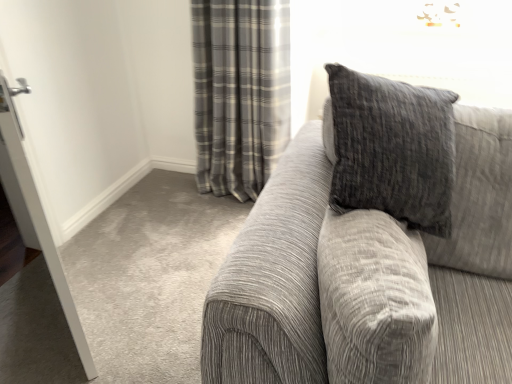
Image resolution: width=512 pixels, height=384 pixels. I want to click on white glossy door at left, so pyautogui.click(x=39, y=214).

This screenshot has width=512, height=384. What do you see at coordinates (240, 92) in the screenshot? I see `gray plaid curtain at upper center` at bounding box center [240, 92].

At what (x,y) coordinates should I click in order to perform the action: click on white glossy door at left. Please return your answer as a coordinate pair (x, y). This screenshot has width=512, height=384. Looking at the image, I should click on (39, 214).

Considering the sizes of objects textured gray couch at right and white glossy door at left in the image provided, who is shorter, textured gray couch at right or white glossy door at left?

Standing shorter between the two is textured gray couch at right.

Measure the distance from textured gray couch at right to white glossy door at left.

textured gray couch at right and white glossy door at left are 33.07 inches apart.

Is textured gray couch at right at the left side of white glossy door at left?

Incorrect, textured gray couch at right is not on the left side of white glossy door at left.

From a real-world perspective, is textured gray couch at right above or below white glossy door at left?

textured gray couch at right is situated lower than white glossy door at left in the real world.

Is white glossy door at left to the left of gray plaid curtain at upper center from the viewer's perspective?

Correct, you'll find white glossy door at left to the left of gray plaid curtain at upper center.

Is white glossy door at left facing towards gray plaid curtain at upper center?

No, white glossy door at left is not facing towards gray plaid curtain at upper center.

Does white glossy door at left have a greater width compared to gray plaid curtain at upper center?

In fact, white glossy door at left might be narrower than gray plaid curtain at upper center.

This screenshot has height=384, width=512. Find the location of `screen door that is in front of the gray plaid curtain at upper center`. screen door that is in front of the gray plaid curtain at upper center is located at coordinates (39, 214).

From a real-world perspective, who is located lower, gray plaid curtain at upper center or textured gray couch at right?

In real-world perspective, textured gray couch at right is lower.

Choose the correct answer: Is gray plaid curtain at upper center inside textured gray couch at right or outside it?

gray plaid curtain at upper center is outside textured gray couch at right.

How many degrees apart are the facing directions of gray plaid curtain at upper center and textured gray couch at right?

There is a 4.1-degree angle between the facing directions of gray plaid curtain at upper center and textured gray couch at right.

Is gray plaid curtain at upper center touching white glossy door at left?

No, gray plaid curtain at upper center is not touching white glossy door at left.

From a real-world perspective, does gray plaid curtain at upper center sit lower than white glossy door at left?

Yes, from a real-world perspective, gray plaid curtain at upper center is below white glossy door at left.

Looking at this image, is gray plaid curtain at upper center aimed at white glossy door at left?

Yes, gray plaid curtain at upper center is facing white glossy door at left.

Consider the image. Who is taller, textured gray couch at right or gray plaid curtain at upper center?

gray plaid curtain at upper center is taller.

Considering the relative sizes of textured gray couch at right and gray plaid curtain at upper center in the image provided, is textured gray couch at right bigger than gray plaid curtain at upper center?

Yes, textured gray couch at right is bigger than gray plaid curtain at upper center.

What's the angular difference between textured gray couch at right and gray plaid curtain at upper center's facing directions?

The angular difference between textured gray couch at right and gray plaid curtain at upper center is 4.1 degrees.

Which object is wider, textured gray couch at right or gray plaid curtain at upper center?

textured gray couch at right.

From the image's perspective, is white glossy door at left on textured gray couch at right?

Yes, from the image's perspective, white glossy door at left is over textured gray couch at right.

Is white glossy door at left oriented towards textured gray couch at right?

No, white glossy door at left is not facing towards textured gray couch at right.

Between white glossy door at left and textured gray couch at right, which one has larger width?

textured gray couch at right.

Considering the relative positions of white glossy door at left and textured gray couch at right in the image provided, is white glossy door at left behind textured gray couch at right?

Yes, white glossy door at left is further from the viewer.

The height and width of the screenshot is (384, 512). I want to click on studio couch below the white glossy door at left (from a real-world perspective), so click(373, 248).

Where is `curtain above the white glossy door at left (from the image's perspective)`? The width and height of the screenshot is (512, 384). curtain above the white glossy door at left (from the image's perspective) is located at coordinates pos(240,92).

Which object lies nearer to the anchor point textured gray couch at right, white glossy door at left or gray plaid curtain at upper center?

white glossy door at left lies closer to textured gray couch at right than the other object.

Considering their positions, is textured gray couch at right positioned closer to white glossy door at left than gray plaid curtain at upper center?

Among the two, textured gray couch at right is located nearer to white glossy door at left.

Looking at the image, which one is located closer to gray plaid curtain at upper center, textured gray couch at right or white glossy door at left?

textured gray couch at right is positioned closer to the anchor gray plaid curtain at upper center.

Estimate the real-world distances between objects in this image. Which object is closer to gray plaid curtain at upper center, white glossy door at left or textured gray couch at right?

The object closer to gray plaid curtain at upper center is textured gray couch at right.

Which object lies further to the anchor point white glossy door at left, gray plaid curtain at upper center or textured gray couch at right?

The object further to white glossy door at left is gray plaid curtain at upper center.

Based on the photo, estimate the real-world distances between objects in this image. Which object is closer to textured gray couch at right, gray plaid curtain at upper center or white glossy door at left?

Among the two, white glossy door at left is located nearer to textured gray couch at right.

Locate an element on the screen. The width and height of the screenshot is (512, 384). screen door located between textured gray couch at right and gray plaid curtain at upper center in the depth direction is located at coordinates (39, 214).